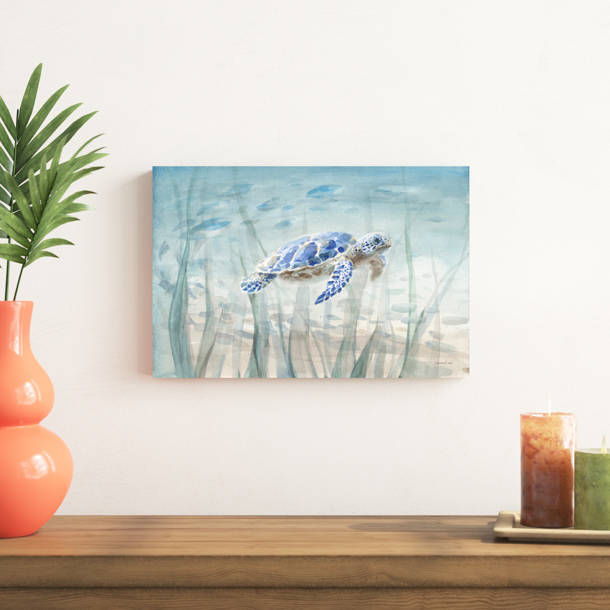
The image size is (610, 610). I want to click on wall above painting, so (312, 69).